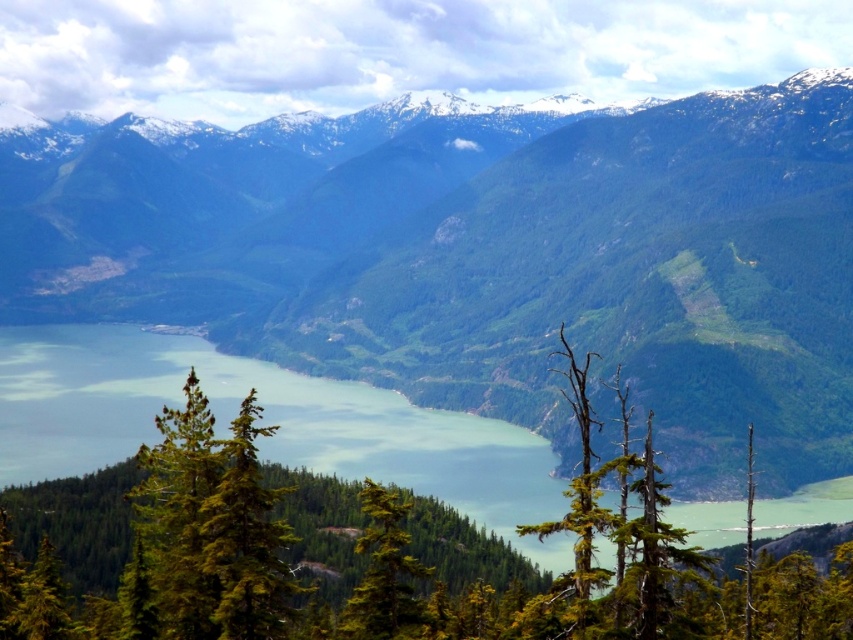
You are standing at the point with coordinates (563, 273) in the mountainous landscape. What can you see directly in front of you?

At point (563, 273) lies green forested mountain range at center, so you can see the green forested mountain range at center directly in front of you.